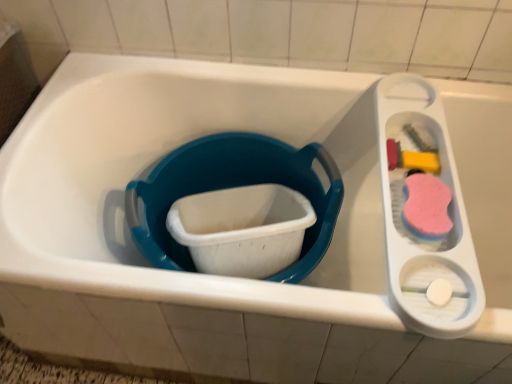
Question: Should I look upward or downward to see blue plastic bucket at center?

Choices:
 (A) down
 (B) up

Answer: (A)